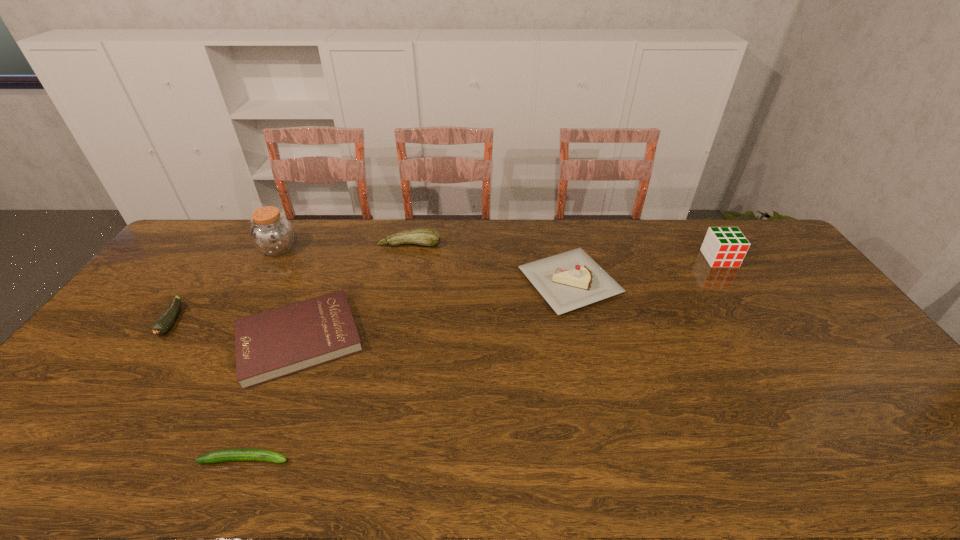
You are a GUI agent. You are given a task and a screenshot of the screen. Output one action in this format:
    pyautogui.click(x=<x>, y=<y>)
    Task: Click on the cube located in the far edge section of the desktop
    Image resolution: width=960 pixels, height=540 pixels.
    Given the screenshot: What is the action you would take?
    pyautogui.click(x=725, y=246)

Find the location of `cake that is at the far edge`. cake that is at the far edge is located at coordinates (567, 281).

Find the location of a particular element. The image size is (960, 540). zucchini situated at the far edge is located at coordinates (426, 237).

Locate an element on the screen. This screenshot has height=540, width=960. object located at the near edge is located at coordinates (227, 455).

Where is `object at the left edge`? Image resolution: width=960 pixels, height=540 pixels. object at the left edge is located at coordinates (164, 323).

The image size is (960, 540). Find the location of `vacant position at the far edge of the desktop`. vacant position at the far edge of the desktop is located at coordinates (679, 227).

Find the location of `vacant region at the near edge of the desktop`. vacant region at the near edge of the desktop is located at coordinates click(x=632, y=467).

I want to click on vacant point at the left edge, so click(101, 358).

In the image, there is a desktop. In order to click on vacant space at the right edge in this screenshot , I will do `click(795, 285)`.

I want to click on empty location between the farthest zucchini and the jar, so click(x=344, y=247).